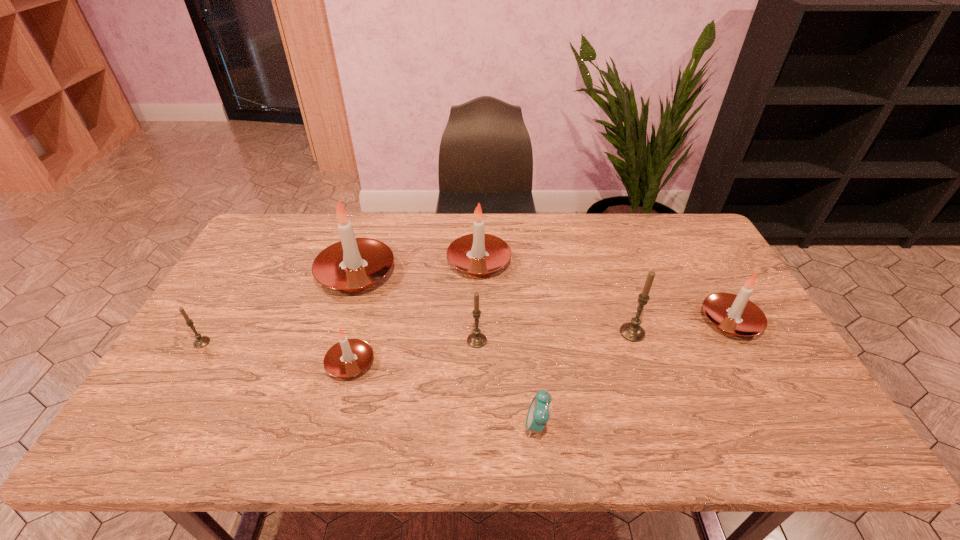
Where is `vacant space located 0.070m on the face of the third object from right to left`? vacant space located 0.070m on the face of the third object from right to left is located at coordinates (494, 425).

The height and width of the screenshot is (540, 960). What are the coordinates of `free space located 0.310m on the face of the third object from right to left` in the screenshot? It's located at (390, 425).

The image size is (960, 540). What are the coordinates of `vacant space positioned 0.160m on the face of the third object from right to left` in the screenshot? It's located at (455, 425).

At what (x,y) coordinates should I click in order to perform the action: click on object that is at the near edge. Please return your answer as a coordinate pair (x, y). This screenshot has width=960, height=540. Looking at the image, I should click on (538, 414).

This screenshot has width=960, height=540. What are the coordinates of `object that is at the left edge` in the screenshot? It's located at (200, 342).

This screenshot has height=540, width=960. Find the location of `object located in the right edge section of the desktop`. object located in the right edge section of the desktop is located at coordinates (736, 315).

Identify the location of vacant space at the far edge of the desktop. point(556,240).

Locate an element on the screen. Image resolution: width=960 pixels, height=540 pixels. vacant area at the near edge is located at coordinates (362, 429).

Image resolution: width=960 pixels, height=540 pixels. I want to click on free space at the far right corner of the desktop, so 697,230.

You are a GUI agent. You are given a task and a screenshot of the screen. Output one action in this format:
    pyautogui.click(x=<x>, y=<y>)
    Task: Click on the vacant space at the near right corner
    Image resolution: width=960 pixels, height=540 pixels.
    Given the screenshot: What is the action you would take?
    pyautogui.click(x=815, y=417)